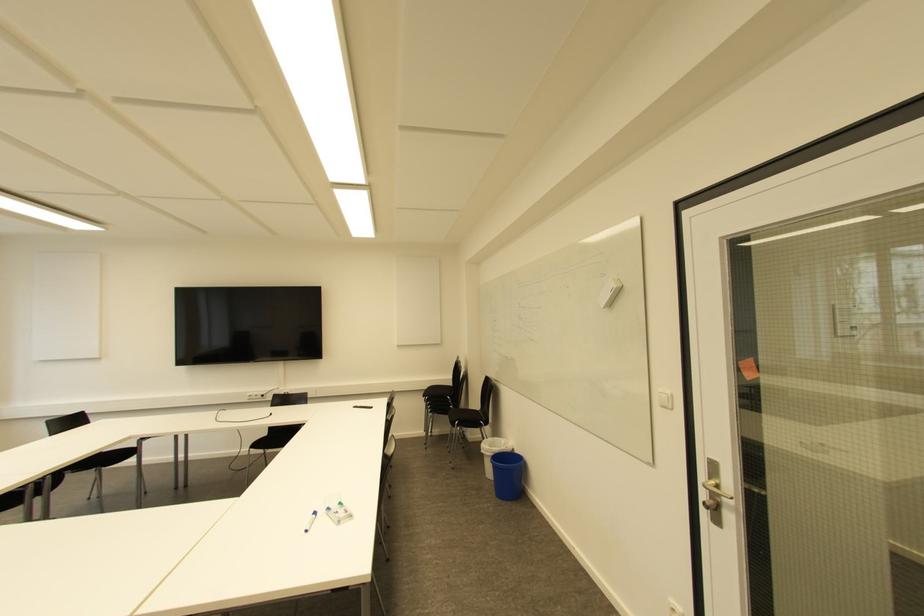
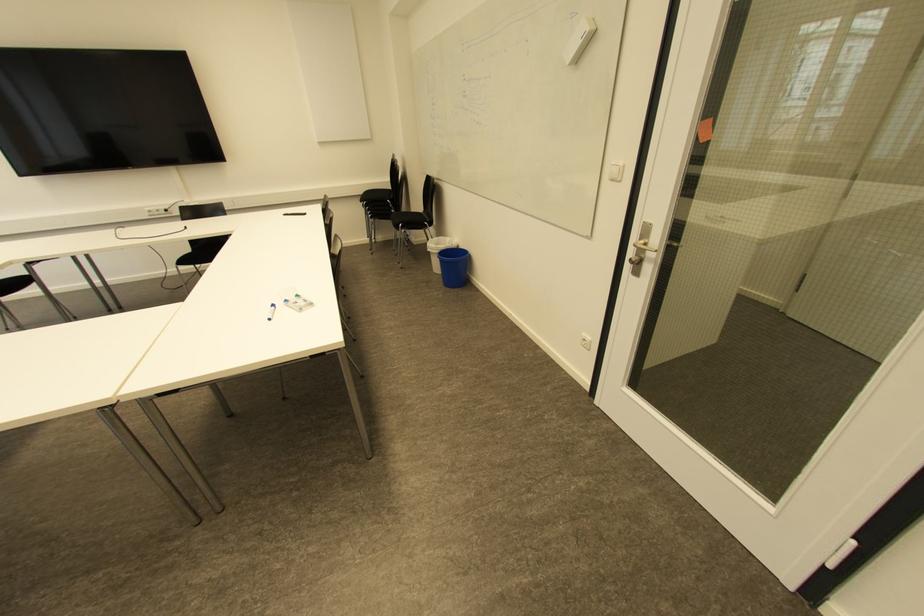
Locate, in the second image, the point that corresponds to pixel 667 392 in the first image.

(621, 163)